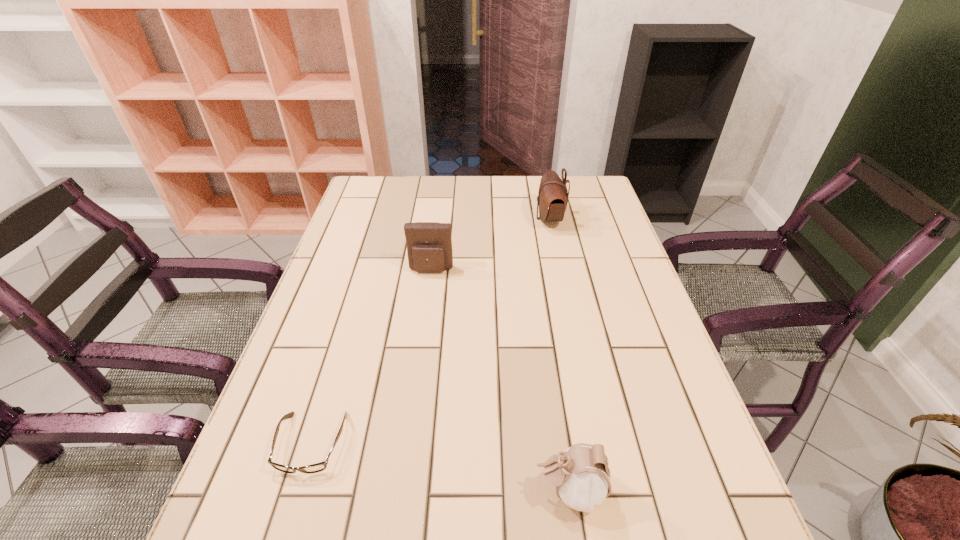
Identify the location of vacant space at the far right corner of the desktop. (609, 207).

Locate an element on the screen. empty location between the farthest pouch and the nearest pouch is located at coordinates (560, 354).

Where is `free spot between the farthest pouch and the nearest pouch`? free spot between the farthest pouch and the nearest pouch is located at coordinates (560, 354).

Identify the location of free area in between the farthest object and the nearest pouch. (560, 354).

Where is `vacant area that lies between the third object from right to left and the nearest pouch`? This screenshot has width=960, height=540. vacant area that lies between the third object from right to left and the nearest pouch is located at coordinates (500, 380).

Locate an element on the screen. free point between the shortest object and the nearest pouch is located at coordinates point(441,467).

Where is `vacant space in between the nearest pouch and the second farthest object`? This screenshot has height=540, width=960. vacant space in between the nearest pouch and the second farthest object is located at coordinates (500, 380).

You are a GUI agent. You are given a task and a screenshot of the screen. Output one action in this format:
    pyautogui.click(x=<x>, y=<y>)
    Task: Click on the empty space that is in between the nearest pouch and the spectacles
    Image resolution: width=960 pixels, height=540 pixels.
    Given the screenshot: What is the action you would take?
    pyautogui.click(x=441, y=467)

Find the location of a particular element. Image resolution: width=960 pixels, height=540 pixels. blank region between the farthest pouch and the nearest pouch is located at coordinates (560, 354).

Image resolution: width=960 pixels, height=540 pixels. Find the location of `free spot between the spectacles and the farthest object`. free spot between the spectacles and the farthest object is located at coordinates (430, 331).